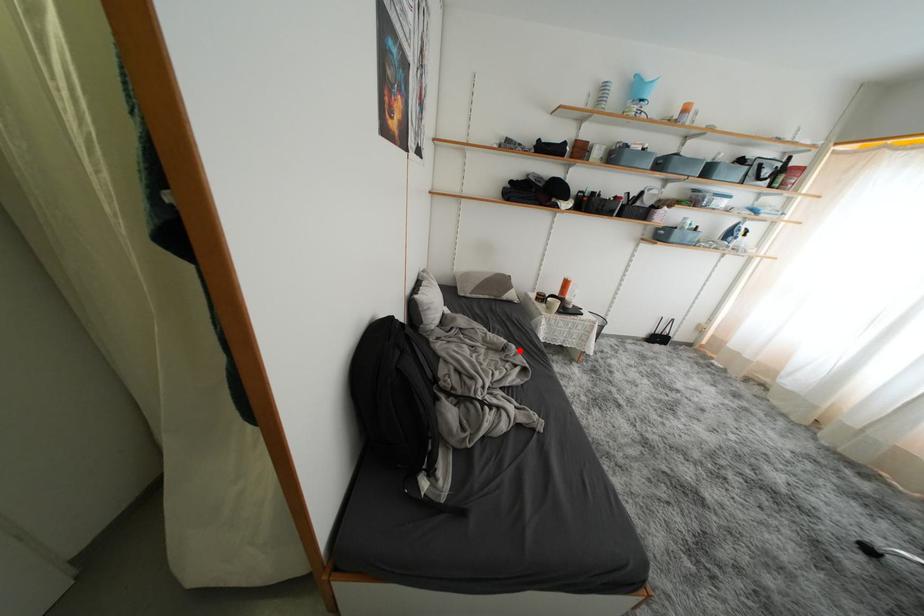
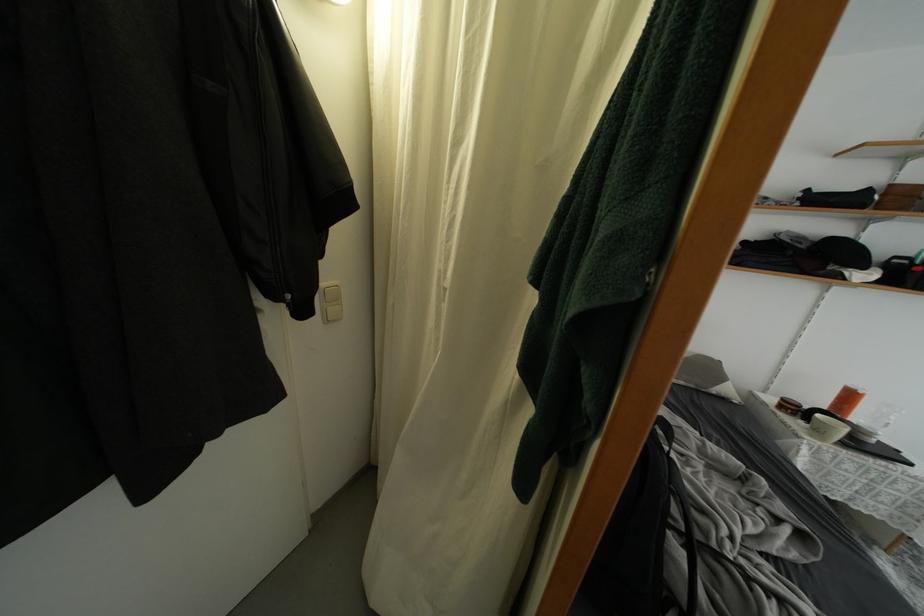
The point at the highlighted location is marked in the first image. Where is the corresponding point in the second image?

(769, 485)